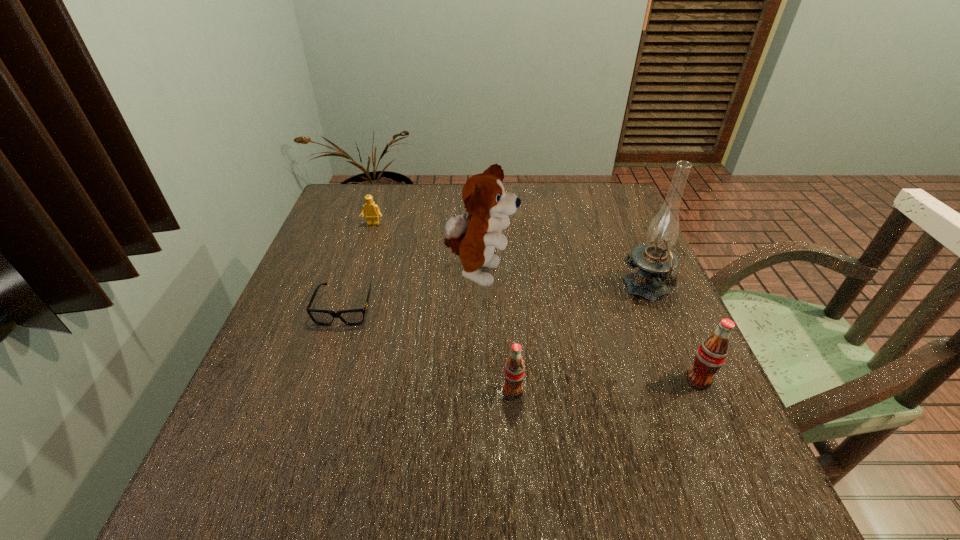
The image size is (960, 540). I want to click on blank space that satisfies the following two spatial constraints: 1. on the face of the puppy; 2. on the back side of the oil lamp, so click(x=479, y=290).

Locate an element on the screen. blank space that satisfies the following two spatial constraints: 1. on the front-facing side of the third tallest object; 2. on the right side of the sunglasses is located at coordinates (322, 380).

This screenshot has height=540, width=960. Find the location of `vacant space that satisfies the following two spatial constraints: 1. on the front-facing side of the shortest object; 2. on the right side of the shorter soda`. vacant space that satisfies the following two spatial constraints: 1. on the front-facing side of the shortest object; 2. on the right side of the shorter soda is located at coordinates (318, 391).

Find the location of a particular element. This screenshot has width=960, height=540. vacant space that satisfies the following two spatial constraints: 1. on the face of the puppy; 2. on the right side of the right soda is located at coordinates (479, 380).

Image resolution: width=960 pixels, height=540 pixels. Identify the location of free location that satisfies the following two spatial constraints: 1. on the face of the second tallest object; 2. on the right side of the right soda. (479, 380).

I want to click on free space in the image that satisfies the following two spatial constraints: 1. on the face of the puppy; 2. on the left side of the fourth shortest object, so click(x=479, y=380).

This screenshot has height=540, width=960. I want to click on free space that satisfies the following two spatial constraints: 1. on the back side of the third tallest object; 2. on the face of the puppy, so click(651, 274).

At what (x,y) coordinates should I click in order to perform the action: click on blank space that satisfies the following two spatial constraints: 1. on the face of the second tallest object; 2. on the back side of the oil lamp. Please return your answer as a coordinate pair (x, y). The image size is (960, 540). Looking at the image, I should click on (479, 290).